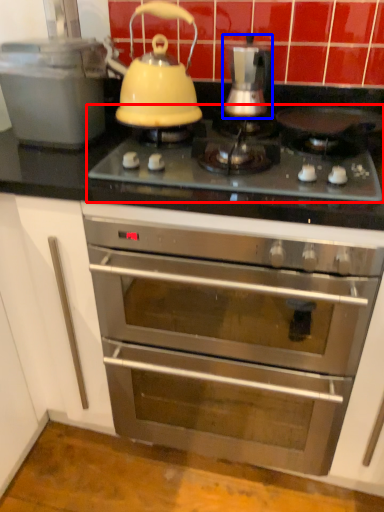
Question: Among these objects, which one is nearest to the camera, gas stove (highlighted by a red box) or kitchen appliance (highlighted by a blue box)?

Choices:
 (A) gas stove
 (B) kitchen appliance

Answer: (A)